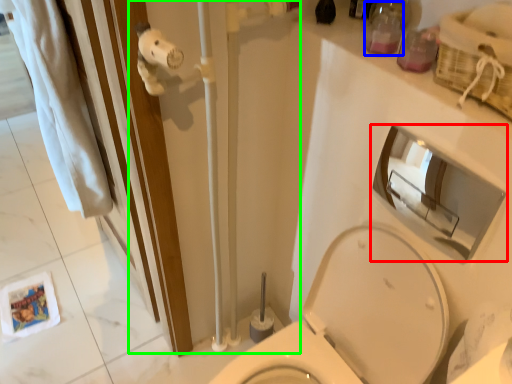
Question: Considering the real-world distances, which object is farthest from mirror (highlighted by a red box)? toiletry (highlighted by a blue box) or shower door (highlighted by a green box)?

Choices:
 (A) toiletry
 (B) shower door

Answer: (B)